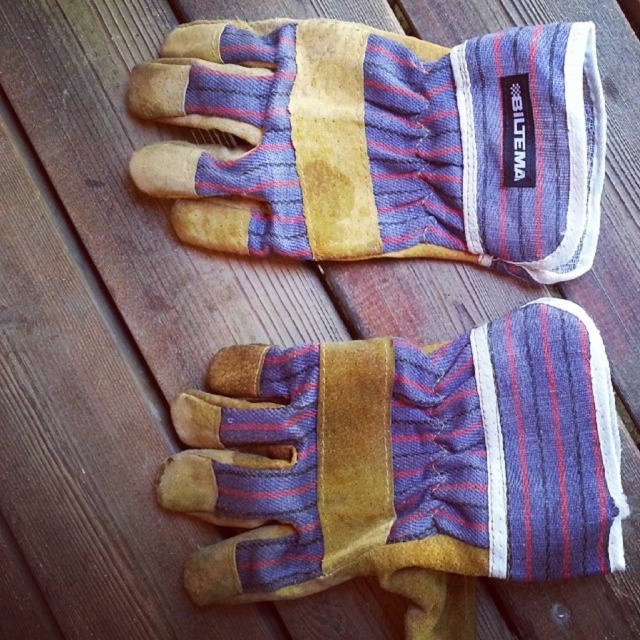
Can you confirm if worn leather glove at center is shorter than leather gloves at center?

Incorrect, worn leather glove at center's height does not fall short of leather gloves at center's.

Measure the distance between worn leather glove at center and leather gloves at center.

worn leather glove at center and leather gloves at center are 10.01 inches apart.

Who is more forward, (428,609) or (500,104)?

Point (428,609)

Find the location of a particular element. This screenshot has width=640, height=640. worn leather glove at center is located at coordinates (404, 465).